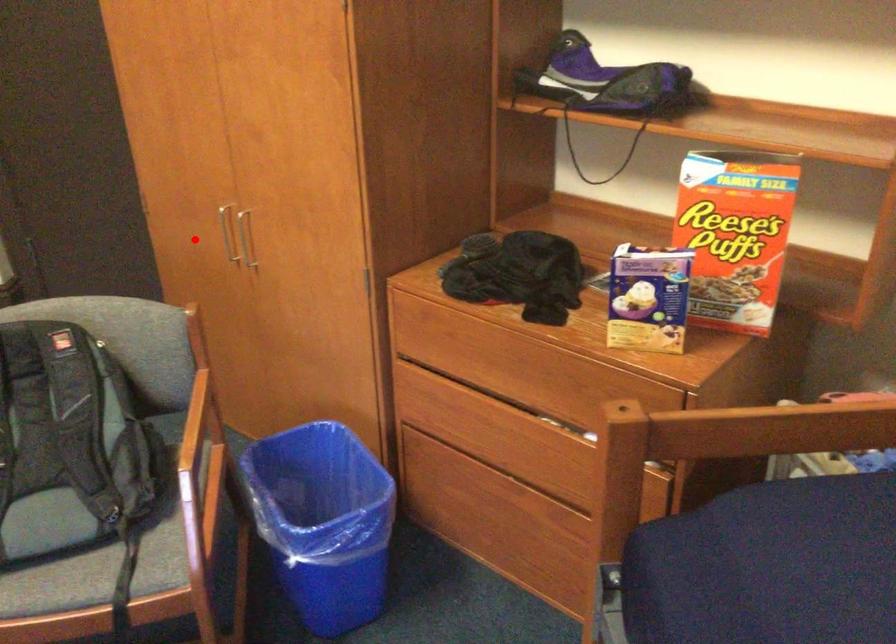
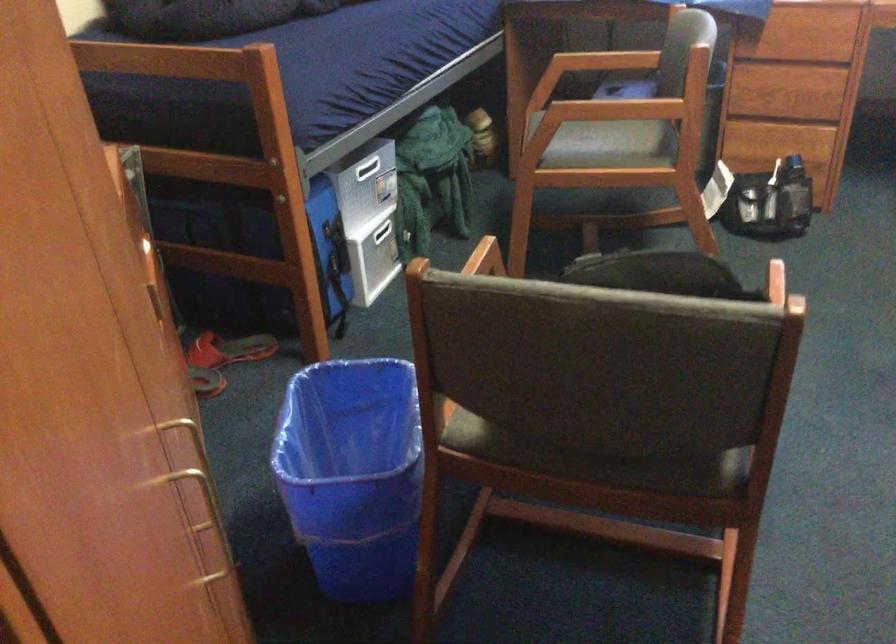
Question: I am providing you with two images of the same scene from different viewpoints. Image1 has a red point marked. In image2, the corresponding 3D location appears at what relative position? Reply with the corresponding letter.

Choices:
 (A) Closer
 (B) Farther

Answer: (A)